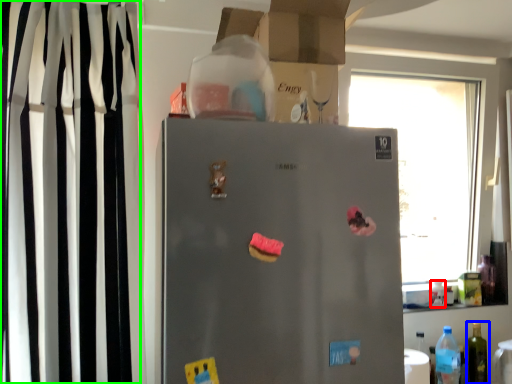
Question: Considering the real-world distances, which object is farthest from bottle (highlighted by a red box)? bottle (highlighted by a blue box) or curtain (highlighted by a green box)?

Choices:
 (A) bottle
 (B) curtain

Answer: (B)